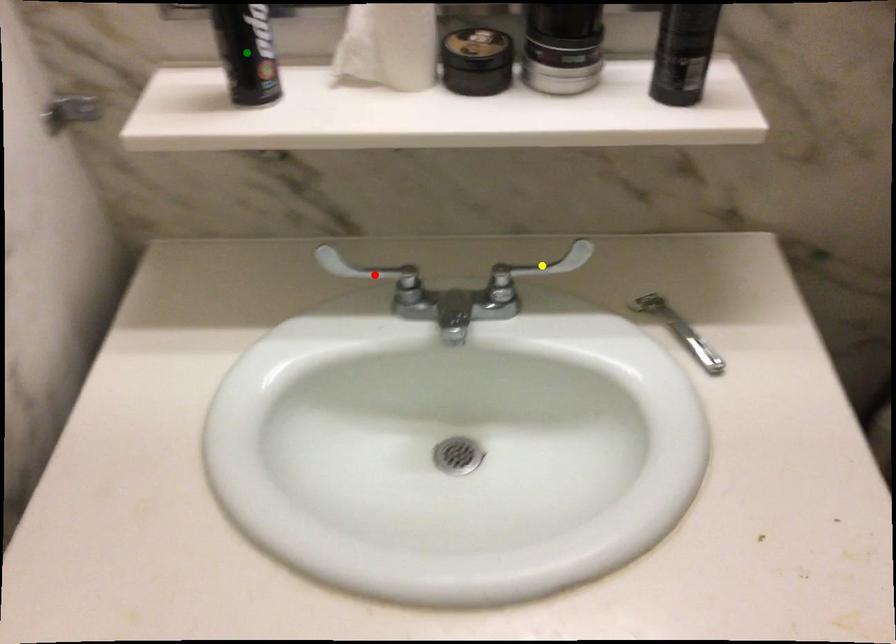
Based on the photo, order these from nearest to farthest:
A) green point
B) red point
C) yellow point

red point < yellow point < green point